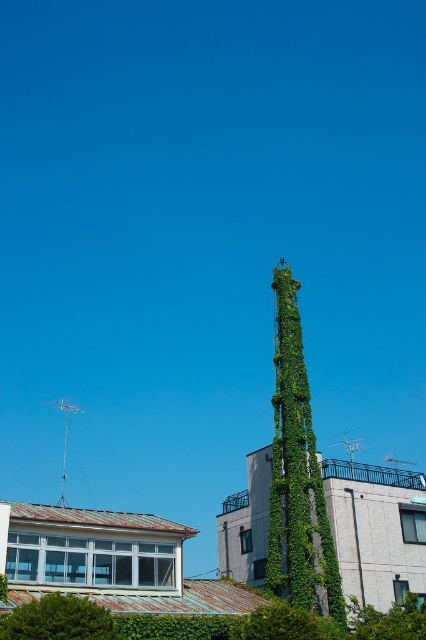
You are standing at the point marked by the coordinates point (58, 620). Looking around, you see a green leafy tree at lower left and the two buildings described in the scene. Which direction should you face to see the green leafy tree at lower left?

The point (58, 620) is located on the green leafy tree at lower left, so you are already facing the tree. To see the green leafy tree at lower left, you should face forward since you are standing on it.